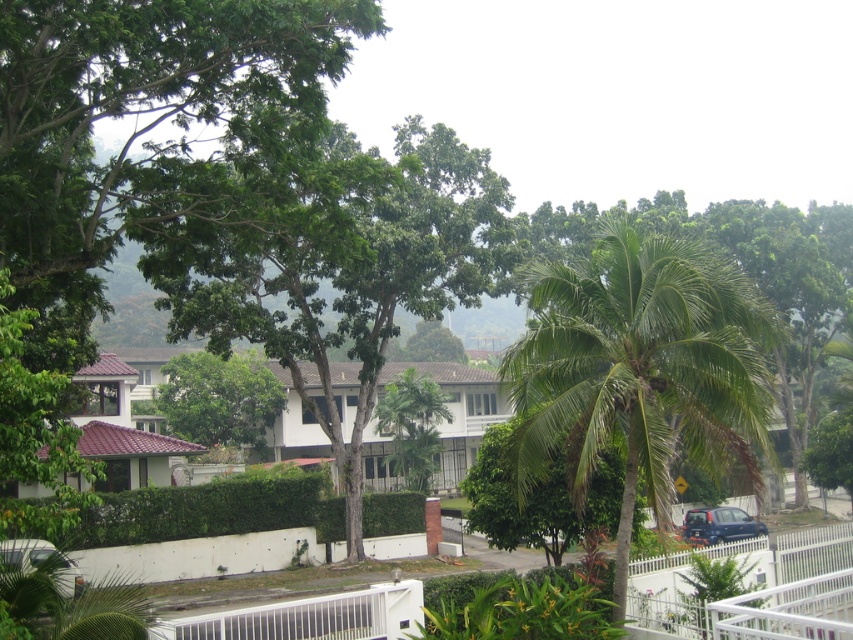
Image resolution: width=853 pixels, height=640 pixels. Describe the element at coordinates (219, 397) in the screenshot. I see `green leafy tree at center` at that location.

Is green leafy tree at center shorter than matte black car at lower left?

No, green leafy tree at center is not shorter than matte black car at lower left.

Is point (247, 444) closer to camera compared to point (13, 566)?

No, (247, 444) is behind (13, 566).

Image resolution: width=853 pixels, height=640 pixels. Find the location of `green leafy tree at center`. green leafy tree at center is located at coordinates (219, 397).

Does matte black car at lower left have a larger size compared to dark blue matte car at lower right?

Yes.

Does matte black car at lower left appear over dark blue matte car at lower right?

Yes, matte black car at lower left is above dark blue matte car at lower right.

Which is behind, point (25, 547) or point (750, 531)?

Positioned behind is point (750, 531).

The width and height of the screenshot is (853, 640). Find the location of `matte black car at lower left`. matte black car at lower left is located at coordinates (41, 563).

The width and height of the screenshot is (853, 640). What do you see at coordinates (788, 611) in the screenshot? I see `white metal rail at lower right` at bounding box center [788, 611].

Between white metal rail at lower right and dark blue matte car at lower right, which one has more height?

dark blue matte car at lower right is taller.

Between point (757, 596) and point (724, 532), which one is positioned behind?

Positioned behind is point (724, 532).

This screenshot has height=640, width=853. Find the location of `white metal rail at lower right`. white metal rail at lower right is located at coordinates (788, 611).